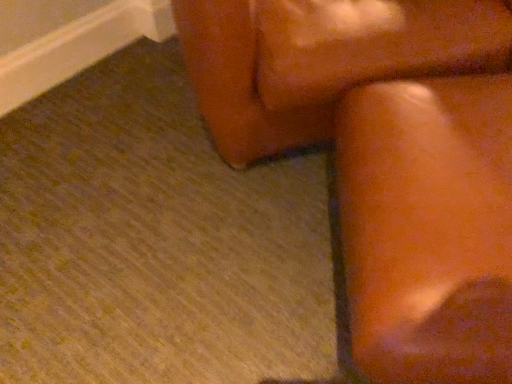
What do you see at coordinates (322, 59) in the screenshot?
I see `leather couch at upper right, which is counted as the first furniture, starting from the top` at bounding box center [322, 59].

Identify the location of matte brown couch at right, which is counted as the first furniture, starting from the bottom. Image resolution: width=512 pixels, height=384 pixels. (428, 228).

Can matte brown couch at right, which is counted as the first furniture, starting from the bottom, be found inside leather couch at upper right, which is counted as the first furniture, starting from the top?

No, leather couch at upper right, which is counted as the first furniture, starting from the top, does not contain matte brown couch at right, which is counted as the first furniture, starting from the bottom.

In terms of width, does leather couch at upper right, the second furniture positioned from the bottom, look wider or thinner when compared to matte brown couch at right, which is counted as the first furniture, starting from the bottom?

leather couch at upper right, the second furniture positioned from the bottom, is wider than matte brown couch at right, which is counted as the first furniture, starting from the bottom.

Is leather couch at upper right, the second furniture positioned from the bottom, behind matte brown couch at right, which is counted as the first furniture, starting from the bottom?

Yes, it is.

In terms of size, does leather couch at upper right, the second furniture positioned from the bottom, appear bigger or smaller than matte brown couch at right, which is counted as the first furniture, starting from the bottom?

In the image, leather couch at upper right, the second furniture positioned from the bottom, appears to be larger than matte brown couch at right, which is counted as the first furniture, starting from the bottom.

Is matte brown couch at right, which is counted as the first furniture, starting from the bottom, further to camera compared to leather couch at upper right, which is counted as the first furniture, starting from the top?

No, it is in front of leather couch at upper right, which is counted as the first furniture, starting from the top.

Is matte brown couch at right, which is counted as the first furniture, starting from the bottom, at the right side of leather couch at upper right, the second furniture positioned from the bottom?

Correct, you'll find matte brown couch at right, which is counted as the first furniture, starting from the bottom, to the right of leather couch at upper right, the second furniture positioned from the bottom.

Is point (429, 158) positioned after point (254, 120)?

No, it is in front of (254, 120).

Can we say matte brown couch at right, positioned as the second furniture in top-to-bottom order, lies outside leather couch at upper right, the second furniture positioned from the bottom?

Yes, matte brown couch at right, positioned as the second furniture in top-to-bottom order, is located beyond the bounds of leather couch at upper right, the second furniture positioned from the bottom.

Where is `rocking chair on the left side of matte brown couch at right, positioned as the second furniture in top-to-bottom order`? The width and height of the screenshot is (512, 384). rocking chair on the left side of matte brown couch at right, positioned as the second furniture in top-to-bottom order is located at coordinates (385, 158).

Which is in front, point (448, 120) or point (487, 81)?

Positioned in front is point (448, 120).

Consider the image. Is matte brown couch at right, which is counted as the first furniture, starting from the bottom, to the left of brown leather rocking chair at upper right from the viewer's perspective?

No.

Consider the image. Can you tell me how much matte brown couch at right, which is counted as the first furniture, starting from the bottom, and brown leather rocking chair at upper right differ in facing direction?

The facing directions of matte brown couch at right, which is counted as the first furniture, starting from the bottom, and brown leather rocking chair at upper right are 53.6 degrees apart.

Is leather couch at upper right, the second furniture positioned from the bottom, taller than brown leather rocking chair at upper right?

Indeed, leather couch at upper right, the second furniture positioned from the bottom, has a greater height compared to brown leather rocking chair at upper right.

Is leather couch at upper right, the second furniture positioned from the bottom, not near brown leather rocking chair at upper right?

They are positioned close to each other.

Where is `rocking chair on the left of the leather couch at upper right, the second furniture positioned from the bottom`? This screenshot has width=512, height=384. rocking chair on the left of the leather couch at upper right, the second furniture positioned from the bottom is located at coordinates (385, 158).

Measure the distance between leather couch at upper right, the second furniture positioned from the bottom, and brown leather rocking chair at upper right.

They are 2.80 inches apart.

Between brown leather rocking chair at upper right and matte brown couch at right, positioned as the second furniture in top-to-bottom order, which one has less height?

With less height is brown leather rocking chair at upper right.

Considering the positions of point (461, 280) and point (444, 356), is point (461, 280) closer or farther from the camera than point (444, 356)?

Clearly, point (461, 280) is more distant from the camera than point (444, 356).

Based on the photo, from a real-world perspective, is brown leather rocking chair at upper right on matte brown couch at right, positioned as the second furniture in top-to-bottom order?

No.

Would you say brown leather rocking chair at upper right is a long distance from matte brown couch at right, positioned as the second furniture in top-to-bottom order?

That's not correct — brown leather rocking chair at upper right is a little close to matte brown couch at right, positioned as the second furniture in top-to-bottom order.

From a real-world perspective, does brown leather rocking chair at upper right stand above leather couch at upper right, which is counted as the first furniture, starting from the top?

No, from a real-world perspective, brown leather rocking chair at upper right is not over leather couch at upper right, which is counted as the first furniture, starting from the top

Is brown leather rocking chair at upper right outside of leather couch at upper right, which is counted as the first furniture, starting from the top?

That's correct, brown leather rocking chair at upper right is outside of leather couch at upper right, which is counted as the first furniture, starting from the top.

In the scene shown: Considering the sizes of objects brown leather rocking chair at upper right and leather couch at upper right, which is counted as the first furniture, starting from the top, in the image provided, who is taller, brown leather rocking chair at upper right or leather couch at upper right, which is counted as the first furniture, starting from the top,?

Standing taller between the two is leather couch at upper right, which is counted as the first furniture, starting from the top.

Where is `the 2nd furniture above the brown leather rocking chair at upper right (from a real-world perspective)`? The height and width of the screenshot is (384, 512). the 2nd furniture above the brown leather rocking chair at upper right (from a real-world perspective) is located at coordinates 322,59.

Locate an element on the screen. furniture behind the matte brown couch at right, which is counted as the first furniture, starting from the bottom is located at coordinates (322, 59).

In the image, there is a leather couch at upper right, which is counted as the first furniture, starting from the top. In order to click on furniture below it (from the image's perspective) in this screenshot , I will do `click(428, 228)`.

Looking at the image, which one is located further to leather couch at upper right, the second furniture positioned from the bottom, matte brown couch at right, which is counted as the first furniture, starting from the bottom, or brown leather rocking chair at upper right?

matte brown couch at right, which is counted as the first furniture, starting from the bottom, is further to leather couch at upper right, the second furniture positioned from the bottom.

Estimate the real-world distances between objects in this image. Which object is further from brown leather rocking chair at upper right, matte brown couch at right, which is counted as the first furniture, starting from the bottom, or leather couch at upper right, the second furniture positioned from the bottom?

leather couch at upper right, the second furniture positioned from the bottom.

Considering their positions, is brown leather rocking chair at upper right positioned closer to matte brown couch at right, which is counted as the first furniture, starting from the bottom, than leather couch at upper right, which is counted as the first furniture, starting from the top?

The object closer to matte brown couch at right, which is counted as the first furniture, starting from the bottom, is brown leather rocking chair at upper right.

Looking at the image, which one is located closer to matte brown couch at right, positioned as the second furniture in top-to-bottom order, leather couch at upper right, the second furniture positioned from the bottom, or brown leather rocking chair at upper right?

brown leather rocking chair at upper right.

Based on their spatial positions, is leather couch at upper right, which is counted as the first furniture, starting from the top, or matte brown couch at right, which is counted as the first furniture, starting from the bottom, closer to brown leather rocking chair at upper right?

Among the two, matte brown couch at right, which is counted as the first furniture, starting from the bottom, is located nearer to brown leather rocking chair at upper right.

Estimate the real-world distances between objects in this image. Which object is closer to leather couch at upper right, which is counted as the first furniture, starting from the top, brown leather rocking chair at upper right or matte brown couch at right, which is counted as the first furniture, starting from the bottom?

Based on the image, brown leather rocking chair at upper right appears to be nearer to leather couch at upper right, which is counted as the first furniture, starting from the top.

At what (x,y) coordinates should I click in order to perform the action: click on rocking chair between leather couch at upper right, the second furniture positioned from the bottom, and matte brown couch at right, positioned as the second furniture in top-to-bottom order, in the vertical direction. Please return your answer as a coordinate pair (x, y). Looking at the image, I should click on (385, 158).